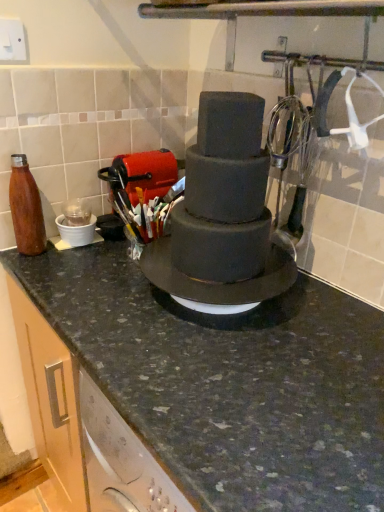
The height and width of the screenshot is (512, 384). I want to click on free spot in front of matte brown bottle at left, so click(41, 275).